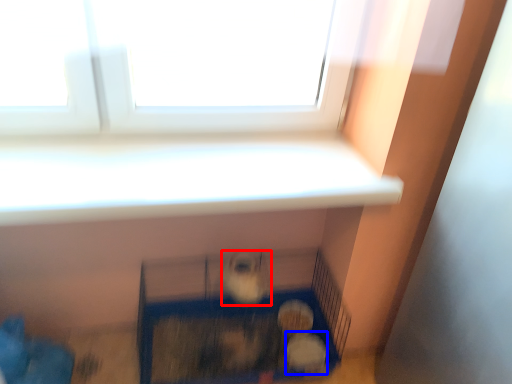
Question: Which point is further to the camera, animal (highlighted by a red box) or animal (highlighted by a blue box)?

Choices:
 (A) animal
 (B) animal

Answer: (B)